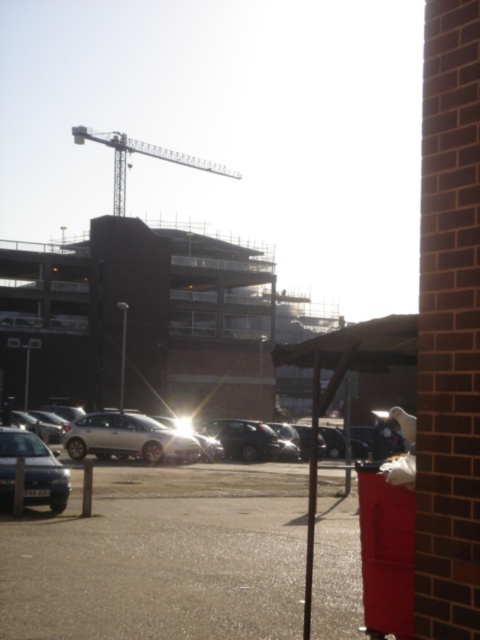
This screenshot has width=480, height=640. What do you see at coordinates (160, 556) in the screenshot? I see `metallic silver car at lower left` at bounding box center [160, 556].

Is metallic silver car at lower left positioned before shiny silver sedan at lower left?

That is True.

At what (x,y) coordinates should I click in order to perform the action: click on metallic silver car at lower left. Please return your answer as a coordinate pair (x, y). This screenshot has width=480, height=640. Looking at the image, I should click on (160, 556).

Identify the location of metallic silver car at lower left. (160, 556).

Can you confirm if metallic silver car at lower left is positioned to the left of metallic pole at center?

Correct, you'll find metallic silver car at lower left to the left of metallic pole at center.

What do you see at coordinates (160, 556) in the screenshot? The width and height of the screenshot is (480, 640). I see `metallic silver car at lower left` at bounding box center [160, 556].

Find the location of a particular element. Image resolution: width=480 pixels, height=640 pixels. metallic silver car at lower left is located at coordinates (160, 556).

Is point (166, 513) closer to viewer compared to point (116, 193)?

Yes.

Consider the image. Can you confirm if metallic silver car at lower left is wider than metallic silver crane at upper center?

In fact, metallic silver car at lower left might be narrower than metallic silver crane at upper center.

Is point (172, 621) less distant than point (119, 193)?

Yes, it is.

The height and width of the screenshot is (640, 480). I want to click on metallic silver car at lower left, so click(x=160, y=556).